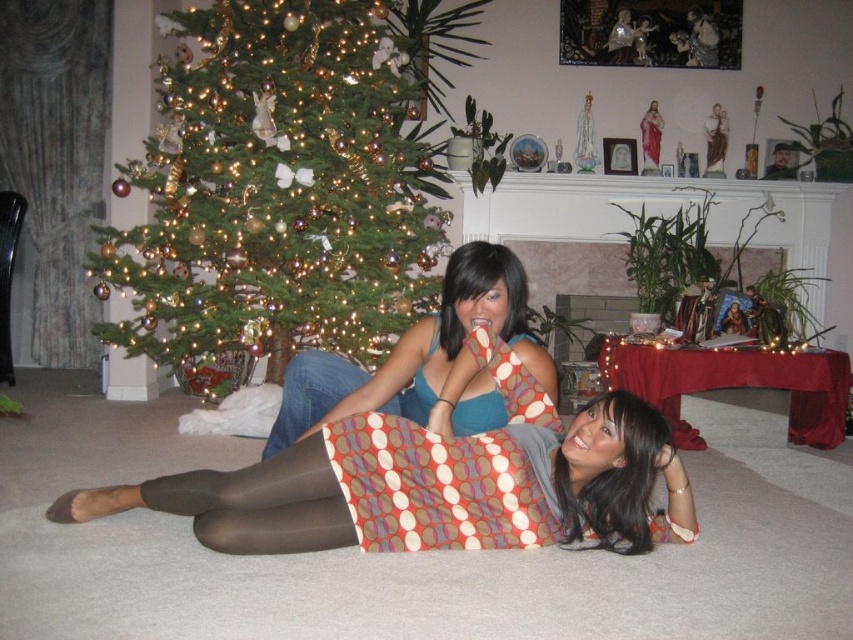
Does shiny gold ornaments at left have a smaller size compared to matte blue tank top at center?

No.

Does shiny gold ornaments at left have a greater height compared to matte blue tank top at center?

Correct, shiny gold ornaments at left is much taller as matte blue tank top at center.

The width and height of the screenshot is (853, 640). Identify the location of shiny gold ornaments at left. (279, 188).

Does polka dot skirt at center appear over polka dot fabric at center?

No, polka dot skirt at center is not above polka dot fabric at center.

Is polka dot skirt at center in front of polka dot fabric at center?

That is True.

I want to click on polka dot skirt at center, so click(428, 490).

The image size is (853, 640). I want to click on polka dot skirt at center, so click(x=428, y=490).

Between matte blue tank top at center and polka dot fabric at center, which one is positioned lower?

polka dot fabric at center is below.

Is the position of matte blue tank top at center less distant than that of polka dot fabric at center?

That is True.

Identify the location of matte blue tank top at center. The width and height of the screenshot is (853, 640). (415, 352).